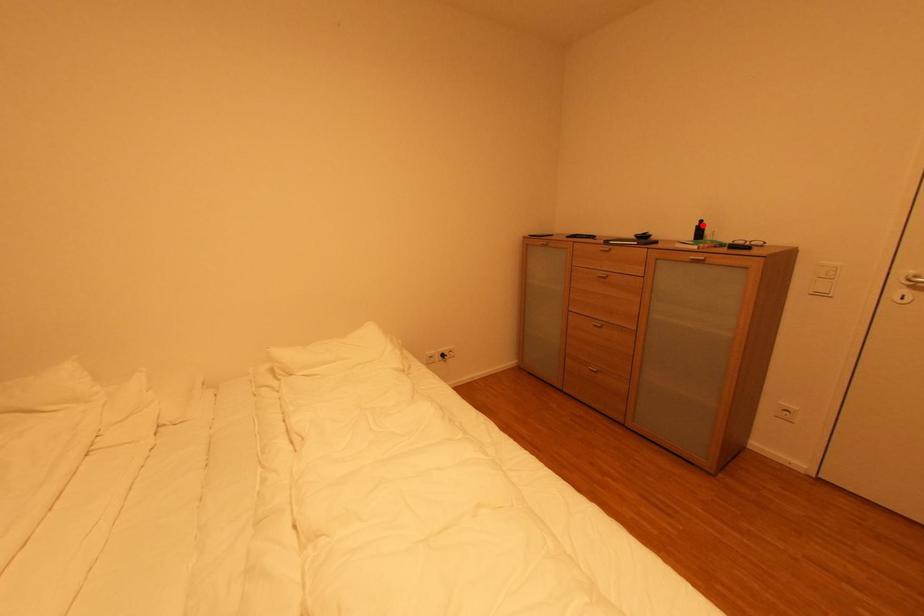
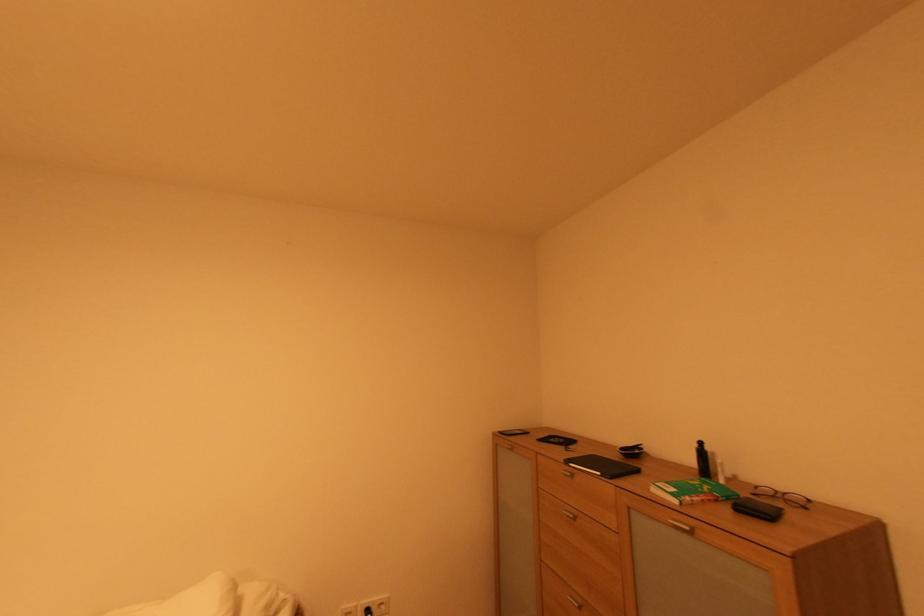
Find the pixel in the second image that matches the highlighted location in the first image.

(701, 447)